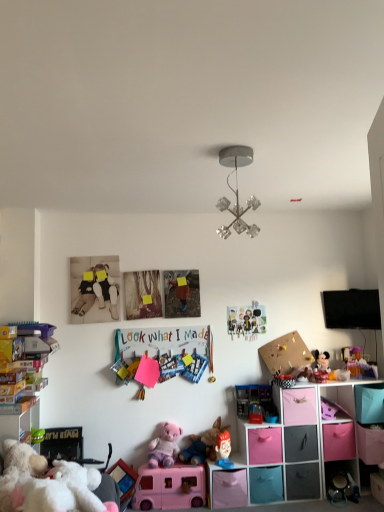
Question: In terms of width, does pink fabric storage cube at lower right look wider or thinner when compared to teal fabric drawer at lower right, which is counted as the third drawer, starting from the left?

Choices:
 (A) thin
 (B) wide

Answer: (A)

Question: In terms of height, does pink fabric storage cube at lower right look taller or shorter compared to teal fabric drawer at lower right, which is the fourth drawer in right-to-left order?

Choices:
 (A) tall
 (B) short

Answer: (B)

Question: Which object is positioned closest to the pink fabric drawer at lower right, which is the 1th drawer in right-to-left order?

Choices:
 (A) plush fabric toy at center, marked as the sixth toy in a right-to-left arrangement
 (B) pink plastic toy bus at lower center, positioned as the eighth toy in right-to-left order
 (C) teal fabric drawer at lower right, which is counted as the third drawer, starting from the left
 (D) matte paper collage at center, the 4th toy viewed from the right
 (E) pink fabric storage cube at lower right

Answer: (E)

Question: Considering the real-world distances, which object is farthest from the metallic crystal chandelier at center?

Choices:
 (A) pink fabric storage cube at lower right
 (B) white plush bear at lower left, which appears as the 10th toy when viewed from the right
 (C) plush mickey mouse at center right, arranged as the 9th toy when viewed from the left
 (D) translucent plastic toy at center, the 8th toy when ordered from left to right
 (E) translucent plastic toy at right, the tenth toy in the left-to-right sequence

Answer: (A)